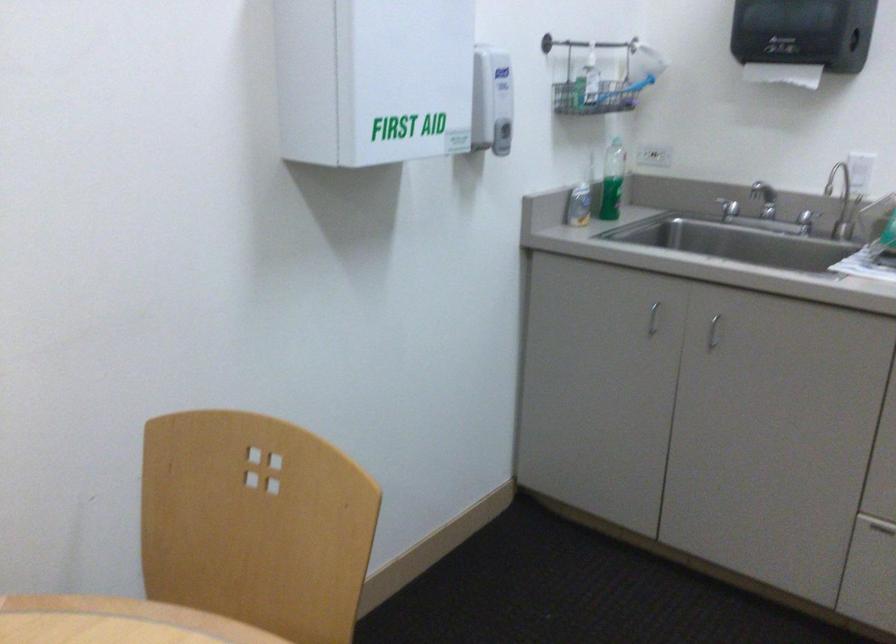
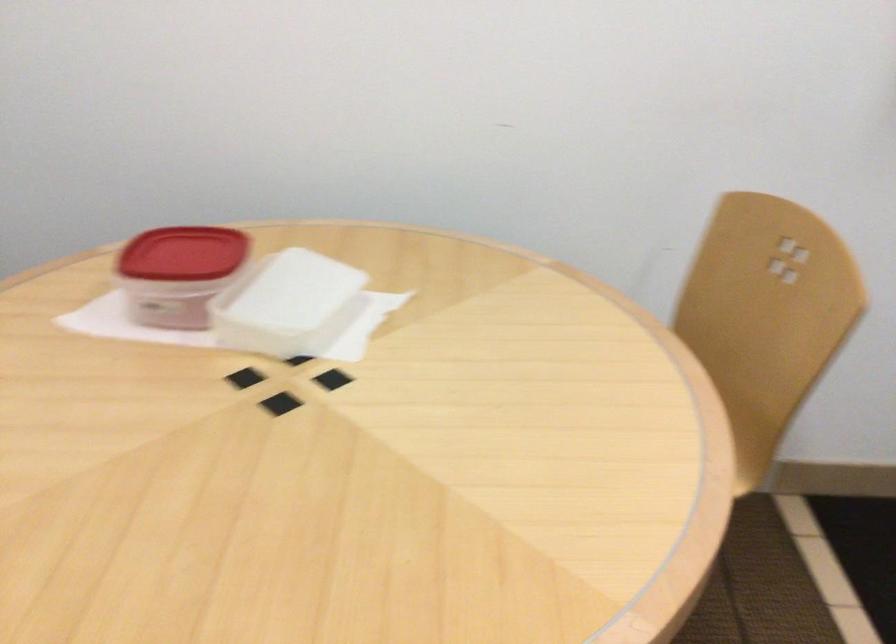
In the second image, find the point that corresponds to pixel 252 474 in the first image.

(788, 260)